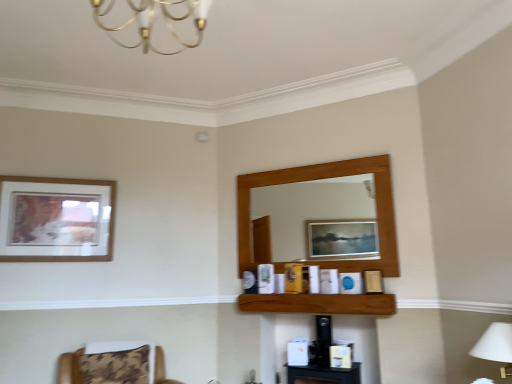
What is the approximate width of wooden picture frame at upper left?

It is 5.28 centimeters.

What do you see at coordinates (56, 219) in the screenshot? The height and width of the screenshot is (384, 512). I see `wooden picture frame at upper left` at bounding box center [56, 219].

What do you see at coordinates (496, 346) in the screenshot?
I see `white fabric lampshade at lower right` at bounding box center [496, 346].

In order to face gold metallic chandelier at upper center, should I rotate leftwards or rightwards?

It's best to rotate left around 13.629 degrees.

What is the approximate height of brown fabric chair at lower left?

brown fabric chair at lower left is 13.45 inches tall.

What do you see at coordinates (114, 364) in the screenshot? I see `brown fabric chair at lower left` at bounding box center [114, 364].

You are a GUI agent. You are given a task and a screenshot of the screen. Output one action in this format:
    pyautogui.click(x=<x>, y=<y>)
    Task: Click on the wooden picture frame at upper left
    
    Given the screenshot: What is the action you would take?
    pyautogui.click(x=56, y=219)

Is gold metallic chandelier at upper center positioned behind brown wooden shelf at center?

No, it is not.

Does point (114, 42) come in front of point (344, 303)?

Yes.

From a real-world perspective, which is physically above, gold metallic chandelier at upper center or brown wooden shelf at center?

From a 3D spatial view, gold metallic chandelier at upper center is above.

Does white fabric lampshade at lower right turn towards gold metallic chandelier at upper center?

No, white fabric lampshade at lower right is not turned towards gold metallic chandelier at upper center.

Is white fabric lampshade at lower right not inside gold metallic chandelier at upper center?

That's correct, white fabric lampshade at lower right is outside of gold metallic chandelier at upper center.

Between white fabric lampshade at lower right and gold metallic chandelier at upper center, which one has larger width?

gold metallic chandelier at upper center.

Would you say white fabric lampshade at lower right is a long distance from gold metallic chandelier at upper center?

Yes, white fabric lampshade at lower right and gold metallic chandelier at upper center are quite far apart.

Is brown wooden shelf at center positioned with its back to white fabric lampshade at lower right?

No, white fabric lampshade at lower right is not at the back of brown wooden shelf at center.

Considering their positions, is brown wooden shelf at center located in front of or behind white fabric lampshade at lower right?

Clearly, brown wooden shelf at center is behind white fabric lampshade at lower right.

From a real-world perspective, does brown wooden shelf at center stand above white fabric lampshade at lower right?

Yes, from a real-world perspective, brown wooden shelf at center is on top of white fabric lampshade at lower right.

Which object is further away from the camera, wooden picture frame at upper left or brown fabric chair at lower left?

wooden picture frame at upper left is further away from the camera.

From a real-world perspective, is wooden picture frame at upper left under brown fabric chair at lower left?

No, from a real-world perspective, wooden picture frame at upper left is not beneath brown fabric chair at lower left.

Is point (54, 182) farther from viewer compared to point (131, 372)?

Yes.

Is wooden picture frame at upper left aimed at brown fabric chair at lower left?

No, wooden picture frame at upper left does not turn towards brown fabric chair at lower left.

Does brown wooden shelf at center come behind gold metallic chandelier at upper center?

That is True.

Between brown wooden shelf at center and gold metallic chandelier at upper center, which one has larger width?

Wider between the two is gold metallic chandelier at upper center.

Is brown wooden shelf at center spatially inside gold metallic chandelier at upper center, or outside of it?

brown wooden shelf at center is located beyond the bounds of gold metallic chandelier at upper center.

Consider the image. Considering the positions of objects brown wooden shelf at center and gold metallic chandelier at upper center in the image provided, who is more to the left, brown wooden shelf at center or gold metallic chandelier at upper center?

From the viewer's perspective, gold metallic chandelier at upper center appears more on the left side.

From a real-world perspective, is white fabric lampshade at lower right under brown fabric chair at lower left?

No.

Is white fabric lampshade at lower right oriented towards brown fabric chair at lower left?

No, white fabric lampshade at lower right does not turn towards brown fabric chair at lower left.

Considering the sizes of white fabric lampshade at lower right and brown fabric chair at lower left in the image, is white fabric lampshade at lower right taller or shorter than brown fabric chair at lower left?

Considering their sizes, white fabric lampshade at lower right has more height than brown fabric chair at lower left.

Considering the sizes of objects white fabric lampshade at lower right and brown fabric chair at lower left in the image provided, who is smaller, white fabric lampshade at lower right or brown fabric chair at lower left?

Smaller between the two is white fabric lampshade at lower right.

Is wooden picture frame at upper left a part of brown fabric chair at lower left?

No, brown fabric chair at lower left does not contain wooden picture frame at upper left.

From a real-world perspective, is brown fabric chair at lower left on wooden picture frame at upper left?

Actually, brown fabric chair at lower left is physically below wooden picture frame at upper left in the real world.

Is brown fabric chair at lower left in front of wooden picture frame at upper left?

That is True.

This screenshot has height=384, width=512. Find the location of `shelf on the right of gold metallic chandelier at upper center`. shelf on the right of gold metallic chandelier at upper center is located at coordinates (319, 303).

Identify the location of light fixture that appears above the white fabric lampshade at lower right (from the image's perspective). Image resolution: width=512 pixels, height=384 pixels. (154, 20).

Based on their spatial positions, is brown wooden shelf at center or white fabric lampshade at lower right further from gold metallic chandelier at upper center?

Among the two, white fabric lampshade at lower right is located further to gold metallic chandelier at upper center.

Based on the photo, from the image, which object appears to be farther from wooden picture frame at upper left, brown fabric chair at lower left or brown wooden shelf at center?

Among the two, brown wooden shelf at center is located further to wooden picture frame at upper left.

Looking at this image, considering their positions, is brown wooden shelf at center positioned further to brown fabric chair at lower left than gold metallic chandelier at upper center?

gold metallic chandelier at upper center lies further to brown fabric chair at lower left than the other object.

From the image, which object appears to be farther from brown fabric chair at lower left, brown wooden shelf at center or white fabric lampshade at lower right?

white fabric lampshade at lower right is further to brown fabric chair at lower left.

Which object lies further to the anchor point gold metallic chandelier at upper center, brown fabric chair at lower left or brown wooden shelf at center?

brown fabric chair at lower left is positioned further to the anchor gold metallic chandelier at upper center.

Looking at the image, which one is located further to white fabric lampshade at lower right, brown wooden shelf at center or gold metallic chandelier at upper center?

gold metallic chandelier at upper center is further to white fabric lampshade at lower right.

Considering their positions, is brown fabric chair at lower left positioned further to white fabric lampshade at lower right than gold metallic chandelier at upper center?

brown fabric chair at lower left is positioned further to the anchor white fabric lampshade at lower right.

Based on their spatial positions, is white fabric lampshade at lower right or brown fabric chair at lower left closer to gold metallic chandelier at upper center?

white fabric lampshade at lower right is closer to gold metallic chandelier at upper center.

You are a GUI agent. You are given a task and a screenshot of the screen. Output one action in this format:
    pyautogui.click(x=<x>, y=<y>)
    Task: Click on the shelf between brown fabric chair at lower left and white fabric lampshade at lower right from left to right
    
    Given the screenshot: What is the action you would take?
    pyautogui.click(x=319, y=303)

Image resolution: width=512 pixels, height=384 pixels. I want to click on shelf situated between wooden picture frame at upper left and white fabric lampshade at lower right from left to right, so click(319, 303).

Image resolution: width=512 pixels, height=384 pixels. Identify the location of furniture situated between wooden picture frame at upper left and brown wooden shelf at center from left to right. (114, 364).

Where is `shelf that lies between gold metallic chandelier at upper center and brown fabric chair at lower left from top to bottom`? shelf that lies between gold metallic chandelier at upper center and brown fabric chair at lower left from top to bottom is located at coordinates (319, 303).